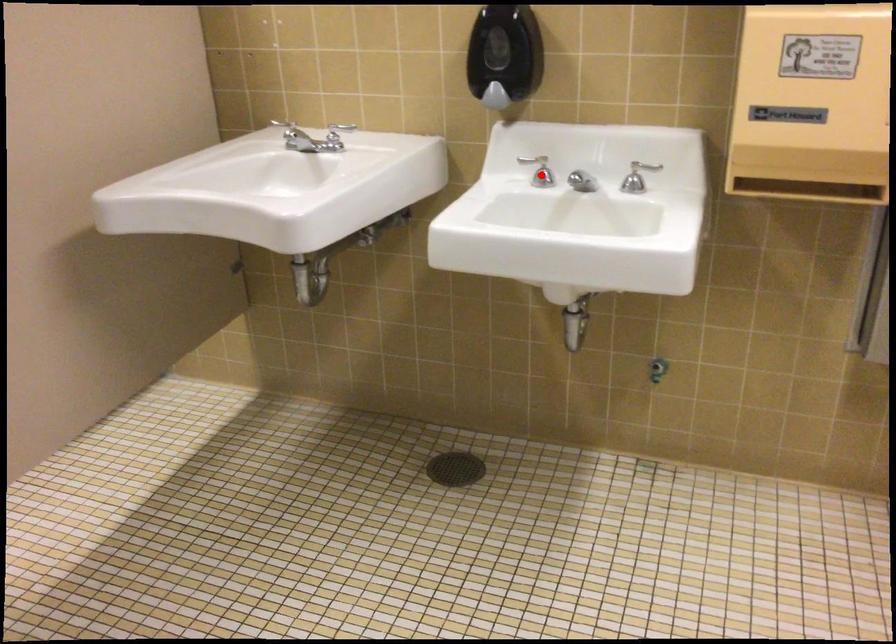
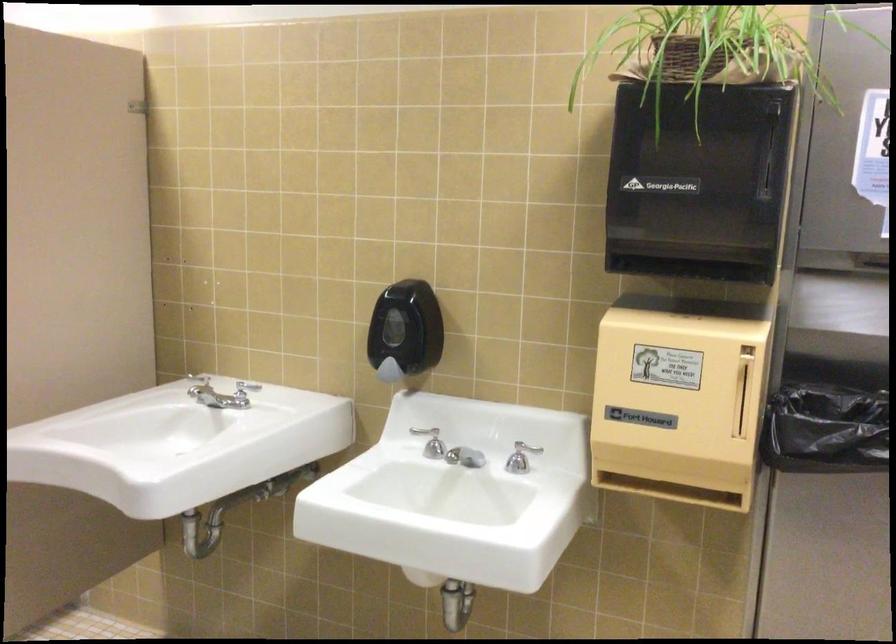
The point at the highlighted location is marked in the first image. Where is the corresponding point in the second image?

(433, 444)